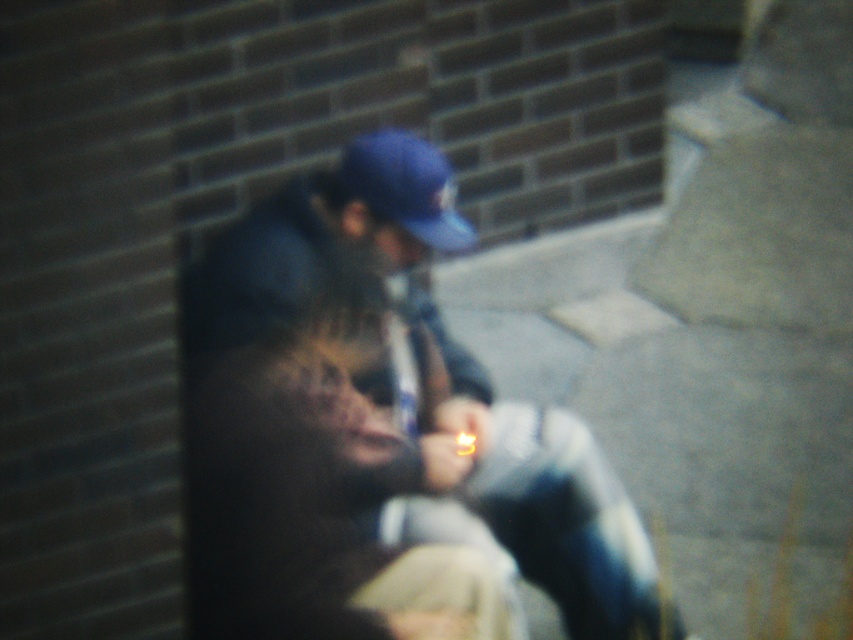
Question: Considering the relative positions of blue denim jacket at center and blue matte baseball cap at center in the image provided, where is blue denim jacket at center located with respect to blue matte baseball cap at center?

Choices:
 (A) below
 (B) above

Answer: (A)

Question: Is blue denim jacket at center behind blue matte baseball cap at center?

Choices:
 (A) yes
 (B) no

Answer: (B)

Question: Which object is closer to the camera taking this photo?

Choices:
 (A) blue denim jacket at center
 (B) blue matte baseball cap at center

Answer: (A)

Question: Which point is closer to the camera?

Choices:
 (A) (370, 180)
 (B) (328, 228)

Answer: (A)

Question: Can you confirm if blue denim jacket at center is positioned to the left of blue matte baseball cap at center?

Choices:
 (A) no
 (B) yes

Answer: (A)